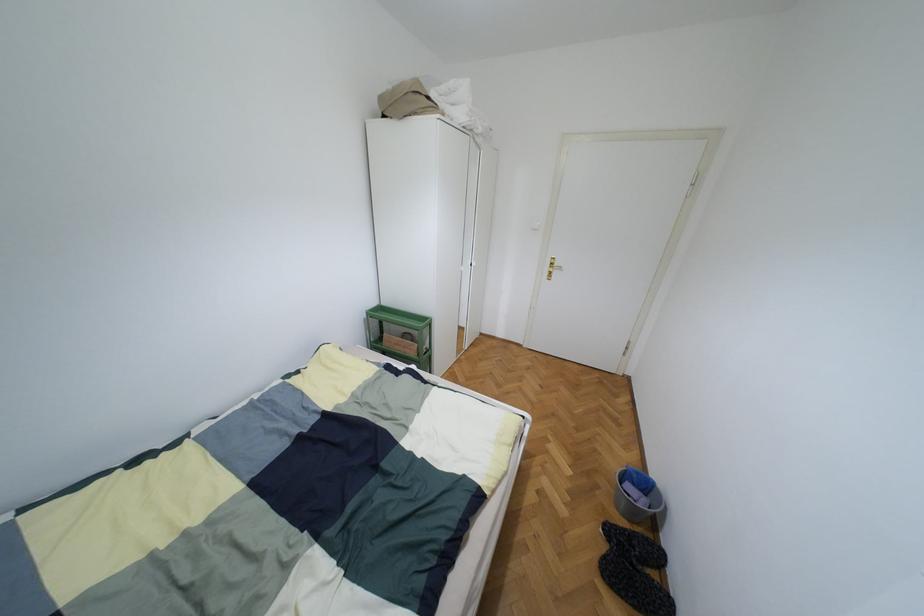
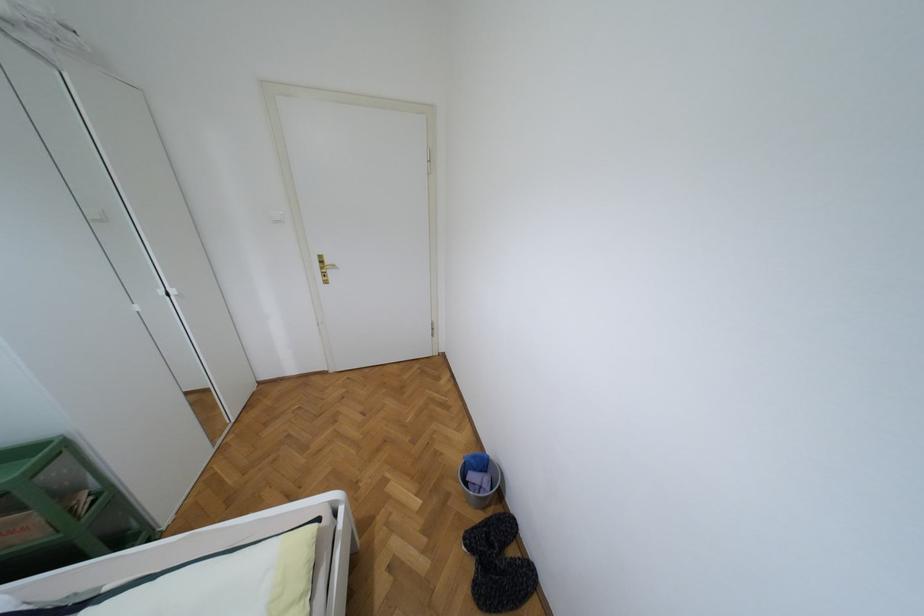
Question: The camera is either moving clockwise (left) or counter-clockwise (right) around the object. The first image is from the beginning of the video and the second image is from the end. Is the camera moving left or right when shooting the video?

Choices:
 (A) Left
 (B) Right

Answer: (A)